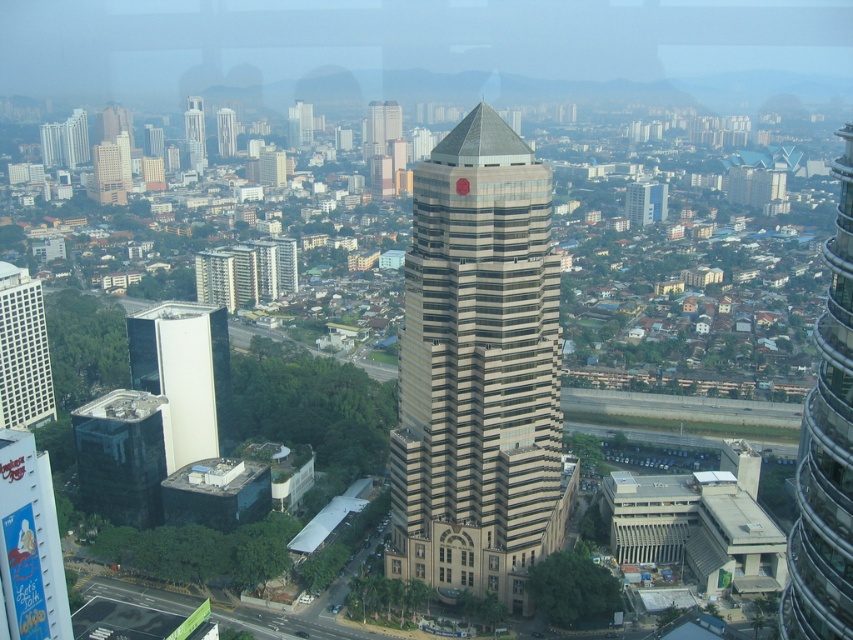
Who is more distant from viewer, [219,408] or [219,120]?

Positioned behind is point [219,120].

Does point (225, 451) come behind point (222, 109)?

No, (225, 451) is closer to viewer.

The height and width of the screenshot is (640, 853). Identify the location of white glass building at left. (184, 372).

Can you confirm if matte beige building at left is positioned to the right of beige stone building at center?

Correct, you'll find matte beige building at left to the right of beige stone building at center.

Who is shorter, matte beige building at left or beige stone building at center?

beige stone building at center

Who is more forward, (6, 387) or (235, 140)?

Point (6, 387)

In order to click on matte beige building at left in this screenshot , I will do `click(22, 352)`.

Based on the photo, who is shorter, beige glass tower at center or matte beige building at left?

With less height is matte beige building at left.

Between beige glass tower at center and matte beige building at left, which one appears on the left side from the viewer's perspective?

matte beige building at left

Between point (506, 234) and point (22, 282), which one is positioned in front?

Point (506, 234) is in front.

Where is `beige glass tower at center`? This screenshot has height=640, width=853. beige glass tower at center is located at coordinates coord(479,371).